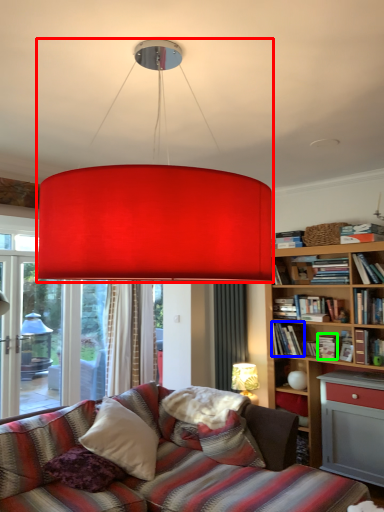
Question: Which is farther away from lamp (highlighted by a red box)? book (highlighted by a blue box) or book (highlighted by a green box)?

Choices:
 (A) book
 (B) book

Answer: (B)